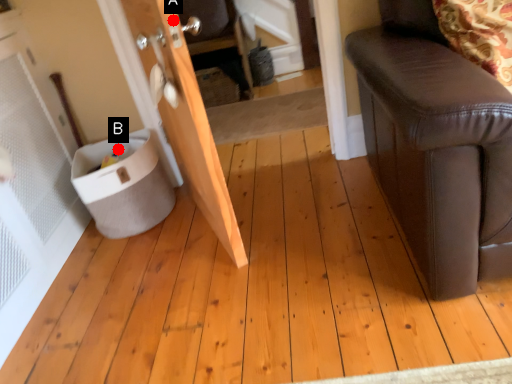
Question: Two points are circled on the image, labeled by A and B beside each circle. Which of the following is the farthest from the observer?

Choices:
 (A) A is further
 (B) B is further

Answer: (B)